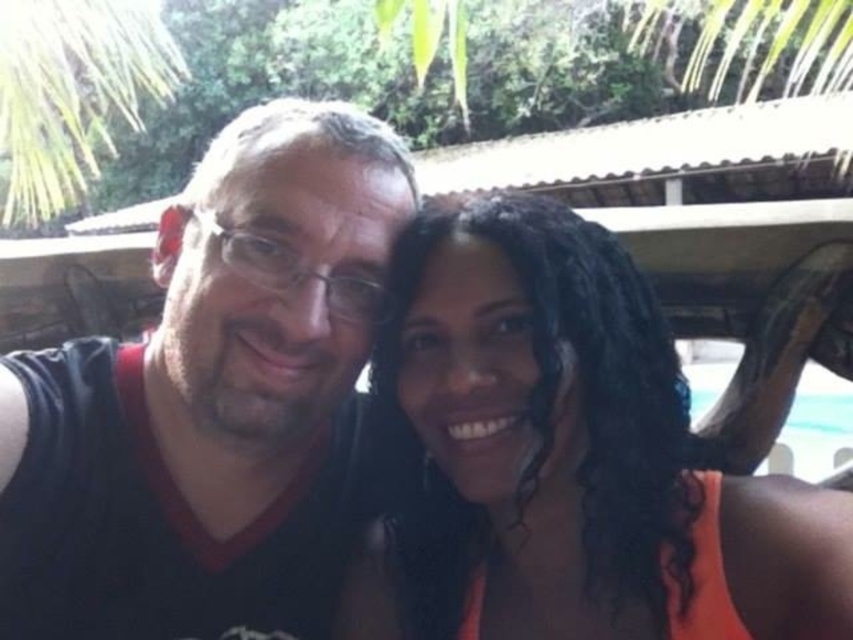
You are standing at the origin point in the image. You want to move towards the point labeled as point (228,266). However, there is an obstacle at point (401,497). Will you encounter the obstacle before reaching your destination?

Point (401,497) is behind point (228,266), so you will not encounter the obstacle before reaching your destination.

You are taking a photo of two people standing side by side. You notice an orange fabric at center and a black matte shirt at center. Which one is more to the right?

The orange fabric at center is more to the right because it is positioned on the right side of the black matte shirt at center.